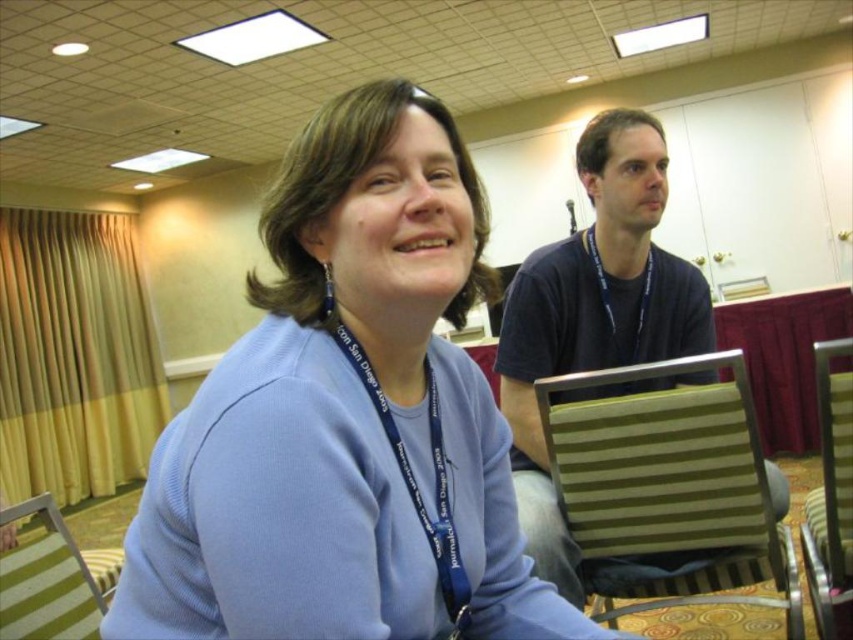
Question: Where is striped fabric chair at lower left located in relation to blue fabric lanyard at center in the image?

Choices:
 (A) left
 (B) right

Answer: (A)

Question: Which point appears farthest from the camera in this image?

Choices:
 (A) (415, 392)
 (B) (839, 412)
 (C) (663, 273)
 (D) (68, 560)

Answer: (C)

Question: Is dark blue t-shirt at upper right positioned behind striped fabric chair at lower left?

Choices:
 (A) yes
 (B) no

Answer: (A)

Question: Which object is farther from the camera taking this photo?

Choices:
 (A) dark blue t-shirt at upper right
 (B) striped fabric chair at lower left
 (C) matte blue sweater at center
 (D) green striped chair at right

Answer: (A)

Question: Where is green striped chair at right located in relation to metallic striped chair at right in the image?

Choices:
 (A) right
 (B) left

Answer: (B)

Question: Among these objects, which one is nearest to the camera?

Choices:
 (A) matte blue sweater at center
 (B) dark blue t-shirt at upper right
 (C) striped fabric chair at lower left

Answer: (A)